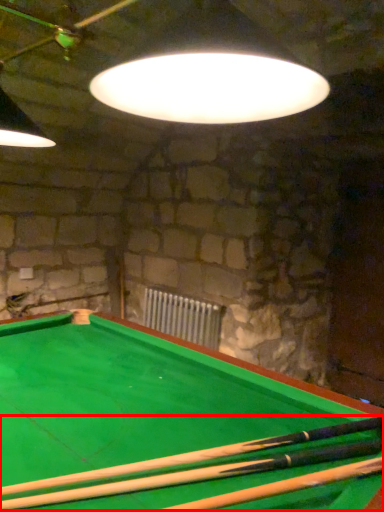
Question: From the image's perspective, where is cue (annotated by the red box) located in relation to radiator in the image?

Choices:
 (A) below
 (B) above

Answer: (B)